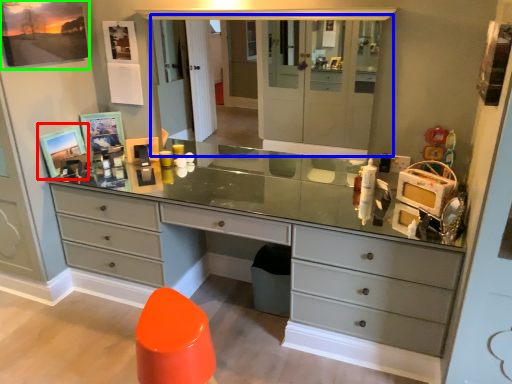
Question: Considering the real-world distances, which object is closest to picture frame (highlighted by a red box)? medicine cabinet (highlighted by a blue box) or picture frame (highlighted by a green box).

Choices:
 (A) medicine cabinet
 (B) picture frame

Answer: (B)